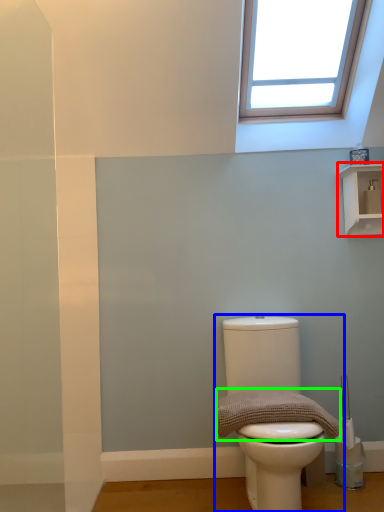
Question: Based on their relative distances, which object is farther from shelf (highlighted by a red box)? Choose from toilet (highlighted by a blue box) and material (highlighted by a green box).

Choices:
 (A) toilet
 (B) material

Answer: (A)